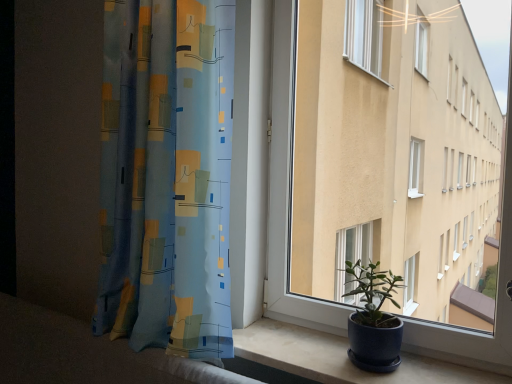
At what (x,y) coordinates should I click in order to perform the action: click on matte blue pot at lower right. Please return your answer as a coordinate pair (x, y). The width and height of the screenshot is (512, 384). Looking at the image, I should click on (374, 320).

I want to click on window sill on the left of matte blue pot at lower right, so click(340, 358).

Is matte concrete window sill at lower right looking in the opposite direction of matte blue pot at lower right?

No, matte concrete window sill at lower right's orientation is not away from matte blue pot at lower right.

From a real-world perspective, who is located higher, matte concrete window sill at lower right or matte blue pot at lower right?

matte blue pot at lower right, from a real-world perspective.

Is matte concrete window sill at lower right next to matte blue pot at lower right?

No, matte concrete window sill at lower right is not touching matte blue pot at lower right.

Are blue fabric curtain at left and matte blue pot at lower right making contact?

blue fabric curtain at left is not next to matte blue pot at lower right, and they're not touching.

Between point (201, 323) and point (361, 356), which one is positioned behind?

The point (201, 323) is farther.

Is blue fabric curtain at left oriented away from matte blue pot at lower right?

blue fabric curtain at left does not have its back to matte blue pot at lower right.

Do you think blue fabric curtain at left is within matte blue pot at lower right, or outside of it?

blue fabric curtain at left is spatially situated outside matte blue pot at lower right.

From the image's perspective, is matte blue pot at lower right located above matte white window at center?

No, from the image's perspective, matte blue pot at lower right is not above matte white window at center.

What's the angular difference between matte blue pot at lower right and matte white window at center's facing directions?

They differ by 0.000481 degrees in their facing directions.

Does matte blue pot at lower right have a greater height compared to matte white window at center?

No, matte blue pot at lower right is not taller than matte white window at center.

Is point (371, 293) less distant than point (281, 152)?

Yes.

Are matte blue pot at lower right and matte concrete window sill at lower right making contact?

No, matte blue pot at lower right is not with matte concrete window sill at lower right.

From a real-world perspective, between matte blue pot at lower right and matte concrete window sill at lower right, who is vertically lower?

matte concrete window sill at lower right.

The image size is (512, 384). I want to click on houseplant above the matte concrete window sill at lower right (from the image's perspective), so click(374, 320).

From the picture: Can you confirm if matte concrete window sill at lower right is smaller than matte white window at center?

Correct, matte concrete window sill at lower right occupies less space than matte white window at center.

Are matte concrete window sill at lower right and matte white window at center located far from each other?

No, there isn't a large distance between matte concrete window sill at lower right and matte white window at center.

Is matte white window at center surrounded by matte concrete window sill at lower right?

That's incorrect, matte white window at center is not inside matte concrete window sill at lower right.

Which of these two, matte concrete window sill at lower right or blue fabric curtain at left, stands shorter?

matte concrete window sill at lower right is shorter.

Considering the sizes of objects matte concrete window sill at lower right and blue fabric curtain at left in the image provided, who is wider, matte concrete window sill at lower right or blue fabric curtain at left?

matte concrete window sill at lower right is wider.

Is matte white window at center next to matte concrete window sill at lower right and touching it?

No, matte white window at center is not in contact with matte concrete window sill at lower right.

Is the position of matte white window at center less distant than that of matte concrete window sill at lower right?

No, matte white window at center is further to the viewer.

Does point (477, 348) appear closer or farther from the camera than point (489, 377)?

Clearly, point (477, 348) is more distant from the camera than point (489, 377).

In the scene shown: How distant is matte white window at center from matte concrete window sill at lower right?

matte white window at center is 7.66 inches away from matte concrete window sill at lower right.

Where is `window sill in front of the matte blue pot at lower right`? The height and width of the screenshot is (384, 512). window sill in front of the matte blue pot at lower right is located at coordinates (340, 358).

I want to click on houseplant on the right of blue fabric curtain at left, so click(x=374, y=320).

Looking at the image, which one is located further to matte blue pot at lower right, matte white window at center or blue fabric curtain at left?

Among the two, blue fabric curtain at left is located further to matte blue pot at lower right.

Which object lies further to the anchor point matte concrete window sill at lower right, blue fabric curtain at left or matte white window at center?

blue fabric curtain at left is further to matte concrete window sill at lower right.

From the image, which object appears to be nearer to matte blue pot at lower right, matte white window at center or matte concrete window sill at lower right?

matte concrete window sill at lower right.

Based on their spatial positions, is matte blue pot at lower right or blue fabric curtain at left closer to matte concrete window sill at lower right?

Among the two, matte blue pot at lower right is located nearer to matte concrete window sill at lower right.

From the picture: Based on their spatial positions, is matte blue pot at lower right or matte concrete window sill at lower right further from matte white window at center?

matte blue pot at lower right is positioned further to the anchor matte white window at center.

From the image, which object appears to be farther from blue fabric curtain at left, matte white window at center or matte concrete window sill at lower right?

The object further to blue fabric curtain at left is matte concrete window sill at lower right.

Looking at the image, which one is located closer to matte blue pot at lower right, blue fabric curtain at left or matte concrete window sill at lower right?

matte concrete window sill at lower right lies closer to matte blue pot at lower right than the other object.

Considering their positions, is blue fabric curtain at left positioned further to matte concrete window sill at lower right than matte blue pot at lower right?

Based on the image, blue fabric curtain at left appears to be further to matte concrete window sill at lower right.

You are a GUI agent. You are given a task and a screenshot of the screen. Output one action in this format:
    pyautogui.click(x=<x>, y=<y>)
    Task: Click on the houseplant between blue fabric curtain at left and matte white window at center
    The image size is (512, 384).
    Given the screenshot: What is the action you would take?
    pyautogui.click(x=374, y=320)

The image size is (512, 384). I want to click on window sill located between blue fabric curtain at left and matte white window at center in the left-right direction, so [x=340, y=358].

The width and height of the screenshot is (512, 384). Find the location of `houseplant between matte white window at center and matte concrete window sill at lower right in the up-down direction`. houseplant between matte white window at center and matte concrete window sill at lower right in the up-down direction is located at coordinates (374, 320).

The height and width of the screenshot is (384, 512). Identify the location of window sill situated between blue fabric curtain at left and matte blue pot at lower right from left to right. (340, 358).